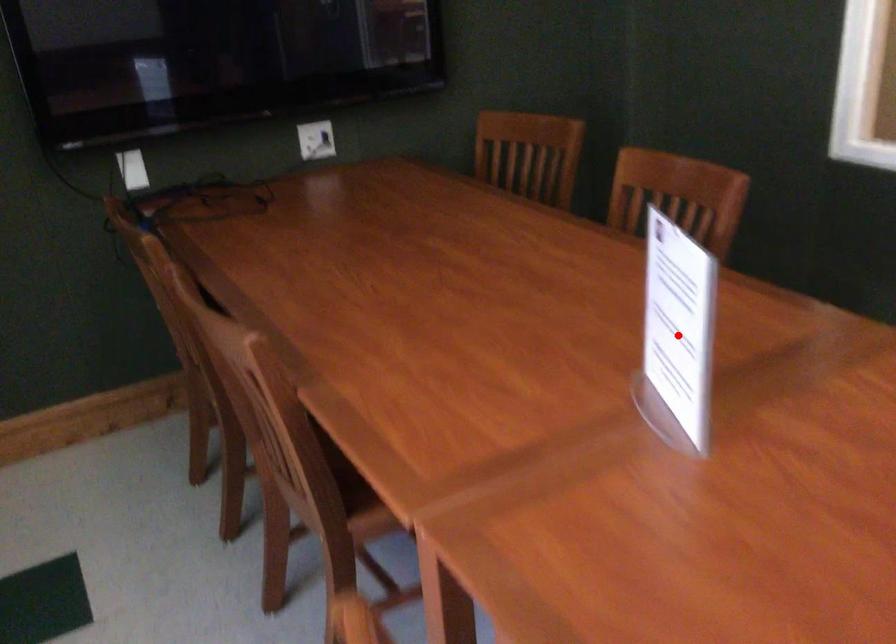
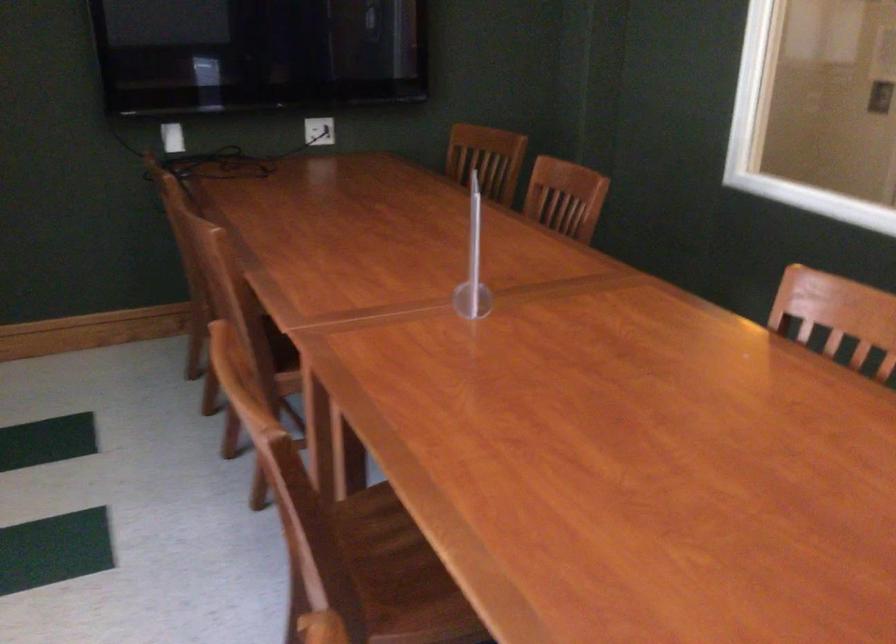
Question: I am providing you with two images of the same scene from different viewpoints. A red point is marked on the first image. Can you still see the location of the red point in image 2?

Choices:
 (A) Yes
 (B) No

Answer: (B)